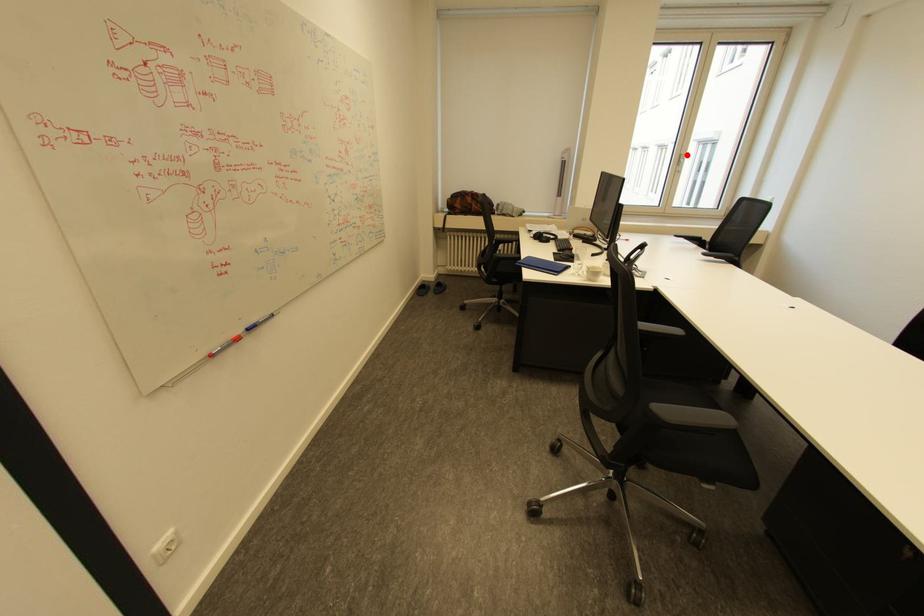
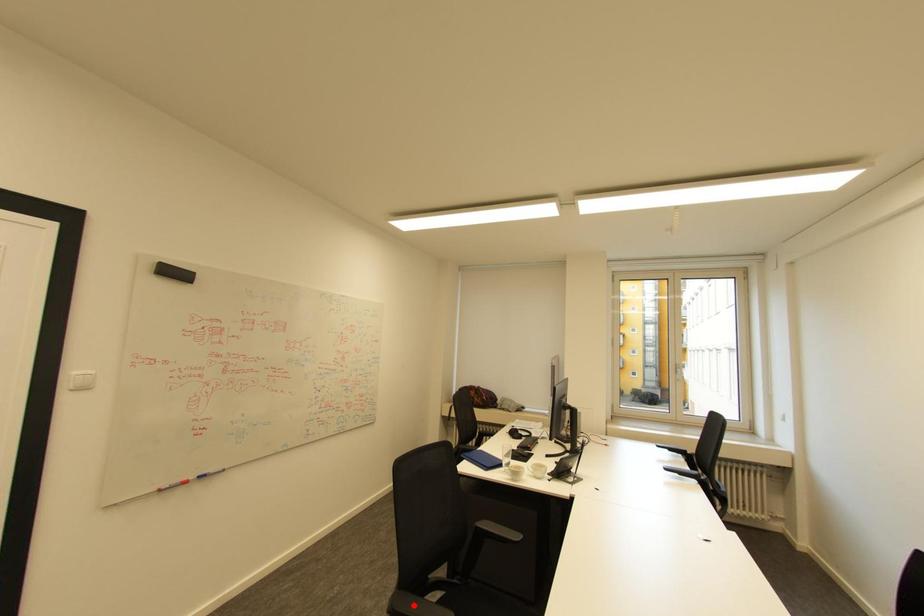
I am providing you with two images of the same scene from different viewpoints. A red point is marked on the first image and another point is marked on the second image. Is the red point in image1 aligned with the point shown in image2?

No